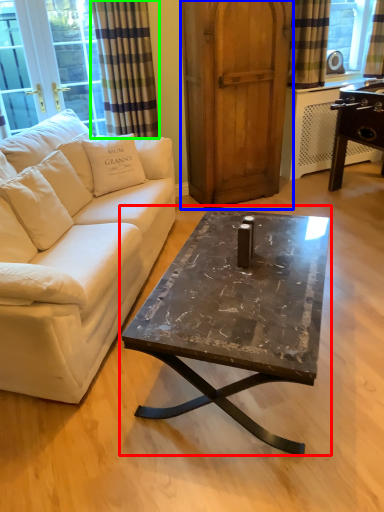
Question: Estimate the real-world distances between objects in this image. Which object is farther from coffee table (highlighted by a red box), armoire (highlighted by a blue box) or curtain (highlighted by a green box)?

Choices:
 (A) armoire
 (B) curtain

Answer: (B)